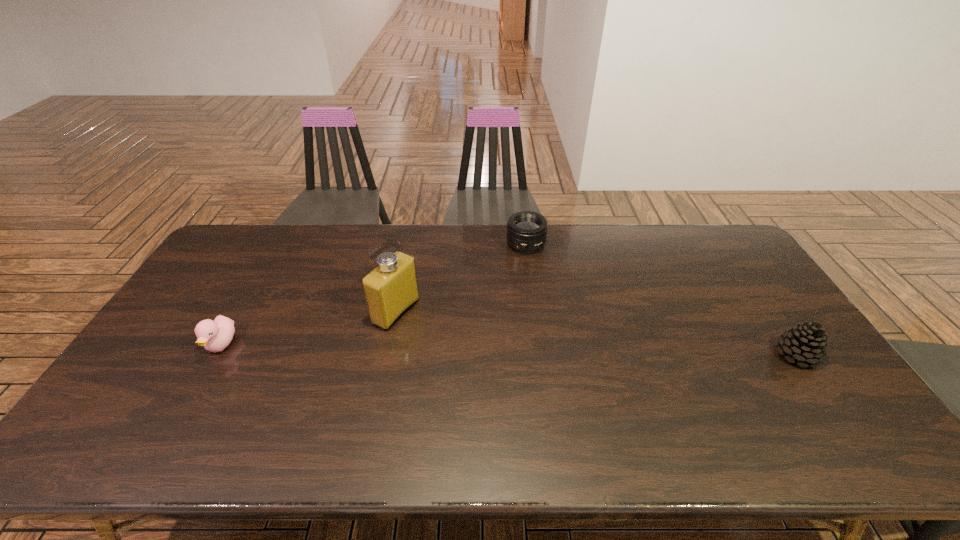
Identify the location of the leftmost object. This screenshot has width=960, height=540. (215, 336).

You are a GUI agent. You are given a task and a screenshot of the screen. Output one action in this format:
    pyautogui.click(x=<x>, y=<y>)
    Task: Click on the pinecone
    
    Given the screenshot: What is the action you would take?
    pyautogui.click(x=806, y=343)

Identify the location of perfume. Image resolution: width=960 pixels, height=540 pixels. (390, 289).

You are a GUI agent. You are given a task and a screenshot of the screen. Output one action in this format:
    pyautogui.click(x=<x>, y=<y>)
    Task: Click on the third object from right to left
    The width and height of the screenshot is (960, 540).
    Given the screenshot: What is the action you would take?
    (390, 289)

You are a GUI agent. You are given a task and a screenshot of the screen. Output one action in this format:
    pyautogui.click(x=<x>, y=<y>)
    Task: Click on the third object from left to right
    This screenshot has width=960, height=540.
    Given the screenshot: What is the action you would take?
    pyautogui.click(x=526, y=231)

Find the location of a particular element. This screenshot has width=960, height=540. the farthest object is located at coordinates (526, 231).

Where is `free space located on the front-facing side of the leftmost object`? free space located on the front-facing side of the leftmost object is located at coordinates (180, 418).

Where is `blank area located on the front-facing side of the perfume`? Image resolution: width=960 pixels, height=540 pixels. blank area located on the front-facing side of the perfume is located at coordinates (470, 349).

At what (x,y) coordinates should I click in order to perform the action: click on free space located 0.330m on the front-facing side of the perfume. Please return your answer as a coordinate pair (x, y). Looking at the image, I should click on (512, 369).

Where is `vacant space located on the front-facing side of the perfume`? vacant space located on the front-facing side of the perfume is located at coordinates (492, 360).